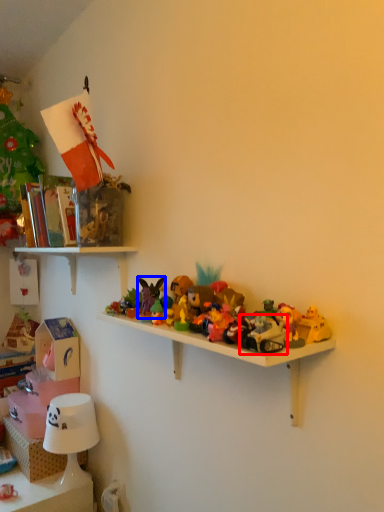
Question: Which object is closer to the camera taking this photo, toy (highlighted by a red box) or toy (highlighted by a blue box)?

Choices:
 (A) toy
 (B) toy

Answer: (A)